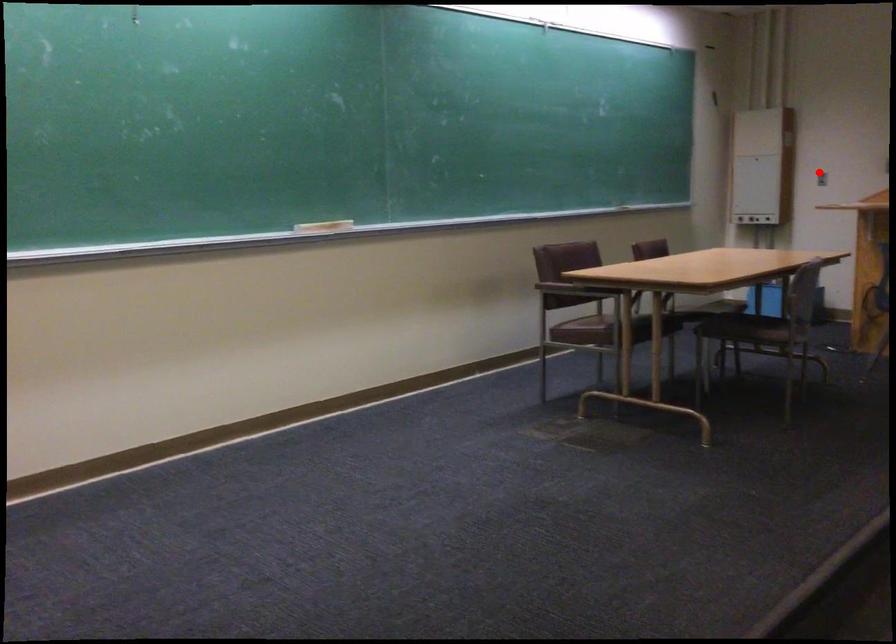
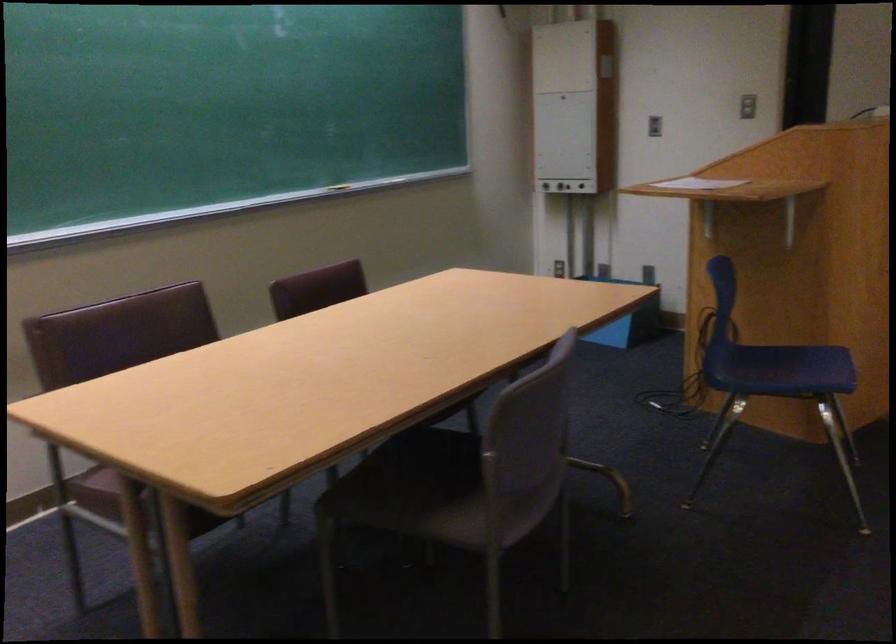
Question: A red point is marked in image1. In image2, is the corresponding 3D point closer to the camera or farther? Reply with the corresponding letter.

Choices:
 (A) The corresponding 3D point is closer.
 (B) The corresponding 3D point is farther.

Answer: (A)